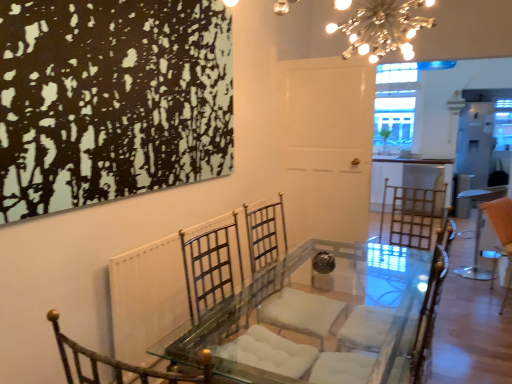
Question: Considering the relative sizes of orange fabric stool at right and metallic gold armchair at center in the image provided, is orange fabric stool at right shorter than metallic gold armchair at center?

Choices:
 (A) no
 (B) yes

Answer: (B)

Question: Considering the relative positions of orange fabric stool at right and metallic gold armchair at center in the image provided, is orange fabric stool at right to the right of metallic gold armchair at center from the viewer's perspective?

Choices:
 (A) no
 (B) yes

Answer: (B)

Question: Does orange fabric stool at right have a greater width compared to metallic gold armchair at center?

Choices:
 (A) yes
 (B) no

Answer: (B)

Question: Is orange fabric stool at right at the left side of metallic gold armchair at center?

Choices:
 (A) no
 (B) yes

Answer: (A)

Question: Is orange fabric stool at right turned away from metallic gold armchair at center?

Choices:
 (A) yes
 (B) no

Answer: (B)

Question: Is there a large distance between orange fabric stool at right and metallic gold armchair at center?

Choices:
 (A) yes
 (B) no

Answer: (A)

Question: Is metallic chandelier at upper center wider than orange fabric stool at right?

Choices:
 (A) no
 (B) yes

Answer: (B)

Question: Is metallic chandelier at upper center facing towards orange fabric stool at right?

Choices:
 (A) yes
 (B) no

Answer: (B)

Question: From the image's perspective, is metallic chandelier at upper center on top of orange fabric stool at right?

Choices:
 (A) no
 (B) yes

Answer: (B)

Question: Does metallic chandelier at upper center have a lesser width compared to orange fabric stool at right?

Choices:
 (A) yes
 (B) no

Answer: (B)

Question: Is metallic chandelier at upper center not within orange fabric stool at right?

Choices:
 (A) no
 (B) yes

Answer: (B)

Question: From a real-world perspective, does metallic chandelier at upper center stand above orange fabric stool at right?

Choices:
 (A) no
 (B) yes

Answer: (B)

Question: Considering the relative sizes of metallic gold armchair at center and orange fabric stool at right in the image provided, is metallic gold armchair at center bigger than orange fabric stool at right?

Choices:
 (A) yes
 (B) no

Answer: (A)